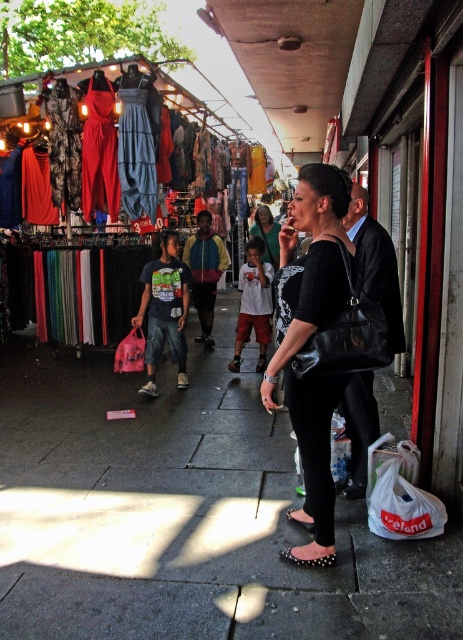
Question: Which of the following is the farthest from the observer?

Choices:
 (A) black leather purse at center
 (B) black studded sandal at lower center
 (C) black leather sandal at center
 (D) black leather jacket at center

Answer: (B)

Question: Is smooth concrete pavement at center thinner than black studded sandal at lower center?

Choices:
 (A) no
 (B) yes

Answer: (A)

Question: Which point is farther from the camera taking this photo?

Choices:
 (A) (298, 518)
 (B) (324, 465)
 (C) (360, 262)
 (D) (6, 566)

Answer: (C)

Question: Is black leather purse at center smaller than black leather sandal at center?

Choices:
 (A) yes
 (B) no

Answer: (B)

Question: Estimate the real-world distances between objects in this image. Which object is closer to the multicolored jacket at center?

Choices:
 (A) black leather sandal at center
 (B) black leather jacket at center
 (C) black studded sandal at lower center

Answer: (B)

Question: Is smooth concrete pavement at center behind matte fabric dresses at left?

Choices:
 (A) no
 (B) yes

Answer: (A)